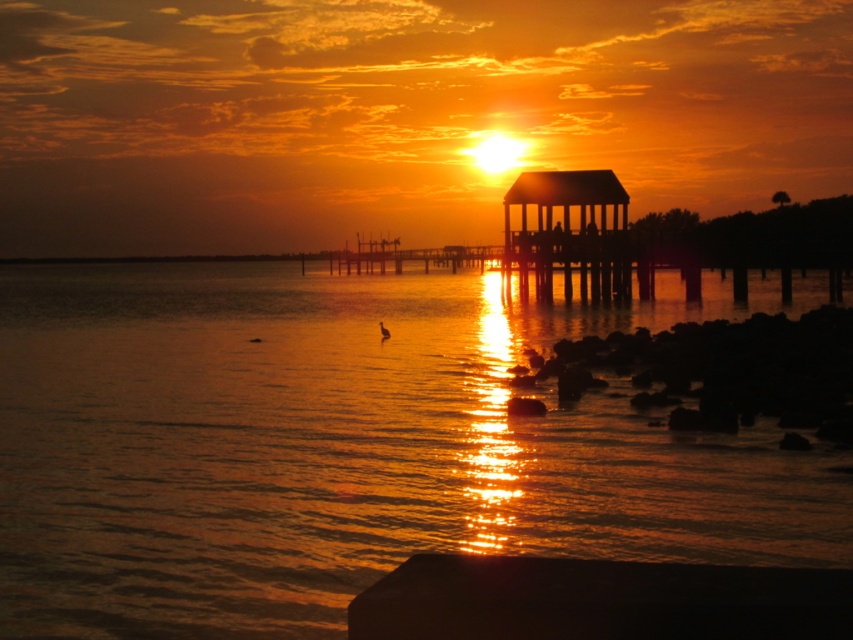
You are standing on the smooth concrete pier at center. You want to walk to the point with coordinates of 0.939, 0.703. Is this possible?

The position of smooth concrete pier at center is at point (x=599, y=600), so yes, you can walk to that point since it is located on the smooth concrete pier at center.

You are a photographer planning to capture the sunset reflection on the shiny reflective water at center. You notice the wooden gazebo at upper right in the background. Will the gazebo block the view of the water reflection if you position yourself directly facing the water?

The shiny reflective water at center might be wider than the wooden gazebo at upper right, so there is a possibility that the gazebo will not fully block the view of the water reflection. However, since the exact width comparison is uncertain, positioning yourself slightly to the side might ensure the gazebo doesn